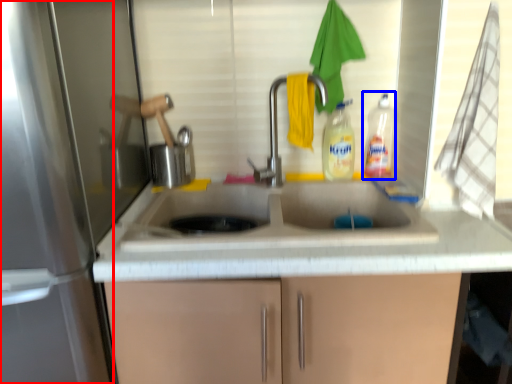
Question: Which object appears closest to the camera in this image, screen door (highlighted by a red box) or bottle (highlighted by a blue box)?

Choices:
 (A) screen door
 (B) bottle

Answer: (A)